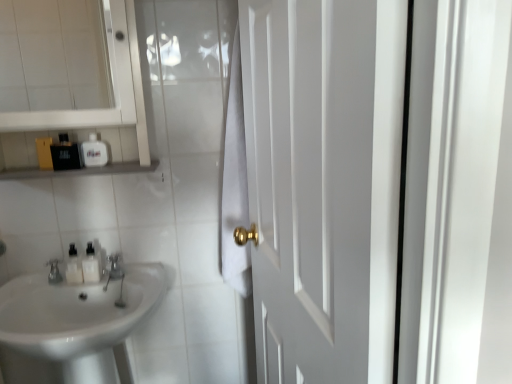
What are the coordinates of `vacant point to the right of white glossy bottles at left, which is counted as the third toiletry, starting from the top` in the screenshot? It's located at (129, 265).